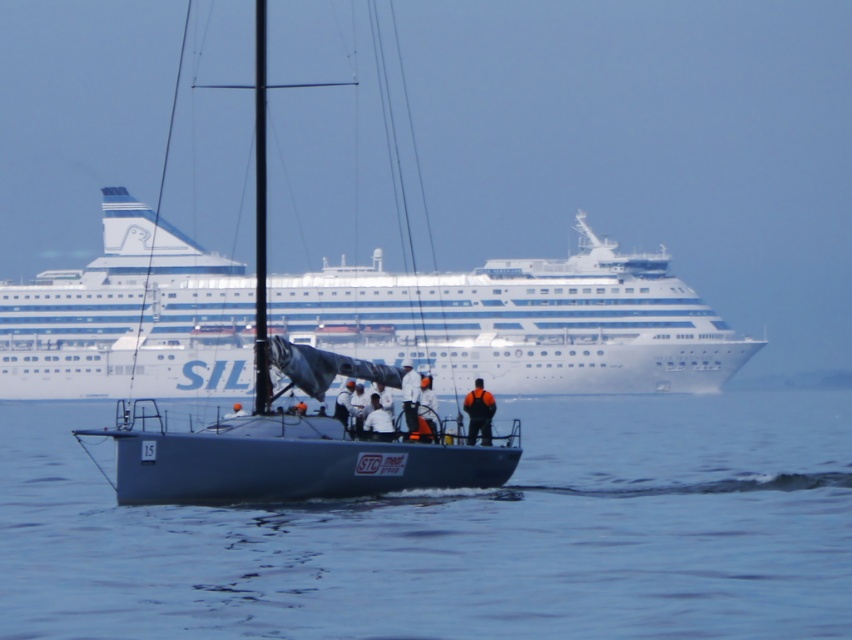
You are standing at point [475,381] and want to reach the nearest vessel. Which vessel should you head towards?

The point [475,381] is closer to the smaller sailboat with a dark blue hull and a mast than the large cruise ship in the background, so you should head towards the smaller sailboat with a dark blue hull and a mast.

You are navigating a small boat and need to determine the position of the white glossy cruise ship at upper center relative to your vessel. According to the coordinates provided, where exactly is the cruise ship positioned?

The white glossy cruise ship at upper center is located at coordinates point (521, 321).